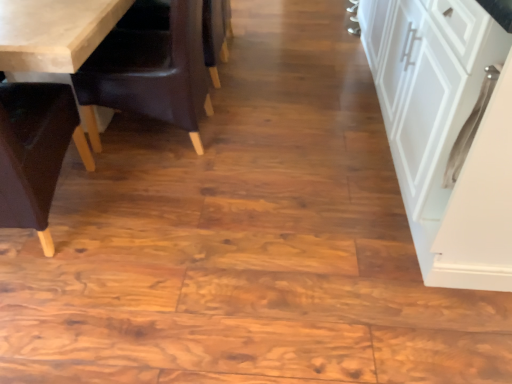
You are a GUI agent. You are given a task and a screenshot of the screen. Output one action in this format:
    pyautogui.click(x=<x>, y=<y>)
    Task: Click on the free spot to the right of brown leather chair at left, placed as the 1th chair when sorted from right to left
    This screenshot has height=384, width=512.
    Given the screenshot: What is the action you would take?
    pyautogui.click(x=260, y=138)